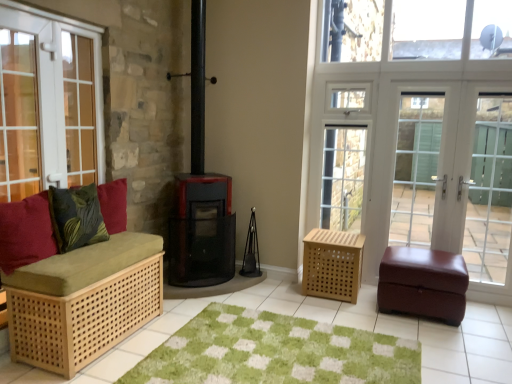
The image size is (512, 384). What do you see at coordinates (275, 352) in the screenshot?
I see `green textured mat at center` at bounding box center [275, 352].

The image size is (512, 384). I want to click on velvet red cushion at left, which ranks as the 1th pillow in front-to-back order, so click(26, 232).

This screenshot has height=384, width=512. What do you see at coordinates (26, 232) in the screenshot?
I see `velvet red cushion at left, which ranks as the 1th pillow in front-to-back order` at bounding box center [26, 232].

At what (x,y) coordinates should I click in order to perform the action: click on natural wood bench at left, which is the third furniture from right to left. Please return your answer as a coordinate pair (x, y). This screenshot has width=512, height=384. Looking at the image, I should click on 84,293.

Locate an element on the screen. This screenshot has height=384, width=512. white glass screen door at right, placed as the third screen door when sorted from right to left is located at coordinates (417, 168).

The height and width of the screenshot is (384, 512). What do you see at coordinates (76, 217) in the screenshot?
I see `velvety green pillow at left, the first pillow when ordered from back to front` at bounding box center [76, 217].

The width and height of the screenshot is (512, 384). I want to click on green textured mat at center, so click(x=275, y=352).

Does transparent glass window at upper center turn towards matte white screen door at right, the second screen door in the left-to-right sequence?

No, transparent glass window at upper center is not oriented towards matte white screen door at right, the second screen door in the left-to-right sequence.

Which object is positioned more to the right, transparent glass window at upper center or matte white screen door at right, the 2th screen door in the right-to-left sequence?

Positioned to the right is matte white screen door at right, the 2th screen door in the right-to-left sequence.

Does point (40, 130) come closer to viewer compared to point (90, 221)?

Yes, it is.

From the image's perspective, is white glass door at left positioned above or below velvety green pillow at left, the 2th pillow viewed from the front?

white glass door at left is situated higher than velvety green pillow at left, the 2th pillow viewed from the front, in the image.

Is white glass door at left oriented away from velvety green pillow at left, the 2th pillow viewed from the front?

No.

Locate an element on the screen. Image resolution: width=512 pixels, height=384 pixels. window located above the velvety green pillow at left, the first pillow when ordered from back to front (from the image's perspective) is located at coordinates (48, 104).

From the image's perspective, between white glass screen door at right, placed as the first screen door when sorted from left to right, and velvety green pillow at left, the first pillow when ordered from back to front, which one is located above?

white glass screen door at right, placed as the first screen door when sorted from left to right.

Is point (408, 146) closer or farther from the camera than point (64, 205)?

Point (408, 146).

Is white glass screen door at right, placed as the first screen door when sorted from left to right, thinner than velvety green pillow at left, the first pillow when ordered from back to front?

Indeed, white glass screen door at right, placed as the first screen door when sorted from left to right, has a lesser width compared to velvety green pillow at left, the first pillow when ordered from back to front.

Is white glass screen door at right, which ranks as the 1th screen door in right-to-left order, shorter than matte white screen door at right, the second screen door in the left-to-right sequence?

Correct, white glass screen door at right, which ranks as the 1th screen door in right-to-left order, is not as tall as matte white screen door at right, the second screen door in the left-to-right sequence.

Is white glass screen door at right, which ranks as the 1th screen door in right-to-left order, facing towards matte white screen door at right, the 2th screen door in the right-to-left sequence?

Yes, white glass screen door at right, which ranks as the 1th screen door in right-to-left order, faces towards matte white screen door at right, the 2th screen door in the right-to-left sequence.

Image resolution: width=512 pixels, height=384 pixels. What are the coordinates of `screen door that is the 2nd one above the white glass screen door at right, the 3th screen door viewed from the left (from a real-world perspective)` in the screenshot? It's located at (456, 177).

Who is taller, velvety green pillow at left, the first pillow when ordered from back to front, or black mesh wood burning stove at center?

With more height is black mesh wood burning stove at center.

Does point (78, 234) come closer to viewer compared to point (176, 215)?

Yes, point (78, 234) is in front of point (176, 215).

Which object is closer to the camera taking this photo, velvety green pillow at left, the first pillow when ordered from back to front, or black mesh wood burning stove at center?

velvety green pillow at left, the first pillow when ordered from back to front.

Is white glass screen door at right, which ranks as the 1th screen door in right-to-left order, taller or shorter than green textured mat at center?

Considering their sizes, white glass screen door at right, which ranks as the 1th screen door in right-to-left order, has more height than green textured mat at center.

From the green textured mat at center, count 3rd screen door to the right and point to it. Please provide its 2D coordinates.

[(490, 190)]

From the image's perspective, is white glass screen door at right, the 3th screen door viewed from the left, located above or below green textured mat at center?

Clearly, from the image's perspective, white glass screen door at right, the 3th screen door viewed from the left, is above green textured mat at center.

Consider the image. Who is bigger, white glass screen door at right, which ranks as the 1th screen door in right-to-left order, or green textured mat at center?

With larger size is white glass screen door at right, which ranks as the 1th screen door in right-to-left order.

Is green textured mat at center closer to the viewer compared to black mesh wood burning stove at center?

That is True.

From a real-world perspective, relative to black mesh wood burning stove at center, is green textured mat at center vertically above or below?

In terms of real-world spatial position, green textured mat at center is below black mesh wood burning stove at center.

Between green textured mat at center and black mesh wood burning stove at center, which one has more height?

With more height is black mesh wood burning stove at center.

Does green textured mat at center have a greater width compared to black mesh wood burning stove at center?

Correct, the width of green textured mat at center exceeds that of black mesh wood burning stove at center.

The width and height of the screenshot is (512, 384). I want to click on window screen lying above the matte white screen door at right, the 2th screen door in the right-to-left sequence (from the image's perspective), so click(x=426, y=29).

From the image's perspective, which pillow is the 1st one below the white glass door at left? Please provide its 2D coordinates.

[(76, 217)]

Looking at the image, which one is located closer to black mesh wood burning stove at center, white glass screen door at right, the 3th screen door viewed from the left, or velvet red cushion at left, which ranks as the 1th pillow in front-to-back order?

Among the two, velvet red cushion at left, which ranks as the 1th pillow in front-to-back order, is located nearer to black mesh wood burning stove at center.

Based on their spatial positions, is transparent glass window at upper center or velvet red cushion at left, the second pillow in the back-to-front sequence, closer to black mesh wood burning stove at center?

Based on the image, velvet red cushion at left, the second pillow in the back-to-front sequence, appears to be nearer to black mesh wood burning stove at center.

When comparing their distances from natural wood bench at left, which is the third furniture from right to left, does light brown woven basket at center-right, the second furniture when ordered from right to left, or burgundy leather ottoman at right, arranged as the 1th furniture when viewed from the right, seem further?

burgundy leather ottoman at right, arranged as the 1th furniture when viewed from the right, is further to natural wood bench at left, which is the third furniture from right to left.

Looking at the image, which one is located further to velvet red cushion at left, which ranks as the 1th pillow in front-to-back order, light brown woven basket at center-right, which ranks as the 2th furniture in left-to-right order, or white glass screen door at right, the 3th screen door viewed from the left?

white glass screen door at right, the 3th screen door viewed from the left.

From the picture: Estimate the real-world distances between objects in this image. Which object is further from black mesh wood burning stove at center, velvet red cushion at left, the second pillow in the back-to-front sequence, or light brown woven basket at center-right, the second furniture when ordered from right to left?

Based on the image, velvet red cushion at left, the second pillow in the back-to-front sequence, appears to be further to black mesh wood burning stove at center.

When comparing their distances from velvety green pillow at left, the 2th pillow viewed from the front, does white glass door at left or velvet red cushion at left, the second pillow in the back-to-front sequence, seem closer?

Among the two, velvet red cushion at left, the second pillow in the back-to-front sequence, is located nearer to velvety green pillow at left, the 2th pillow viewed from the front.

From the image, which object appears to be farther from velvet red cushion at left, which ranks as the 1th pillow in front-to-back order, velvety green pillow at left, the first pillow when ordered from back to front, or transparent glass window at upper center?

transparent glass window at upper center lies further to velvet red cushion at left, which ranks as the 1th pillow in front-to-back order, than the other object.

Considering their positions, is natural wood bench at left, the first furniture viewed from the left, positioned closer to white glass screen door at right, which ranks as the 1th screen door in right-to-left order, than light brown woven basket at center-right, which ranks as the 2th furniture in left-to-right order?

light brown woven basket at center-right, which ranks as the 2th furniture in left-to-right order, lies closer to white glass screen door at right, which ranks as the 1th screen door in right-to-left order, than the other object.

Image resolution: width=512 pixels, height=384 pixels. In order to click on wood burning stove located between white glass door at left and white glass screen door at right, the 3th screen door viewed from the left, in the left-right direction in this screenshot , I will do `click(202, 231)`.

The height and width of the screenshot is (384, 512). In order to click on screen door between white glass door at left and matte white screen door at right, the second screen door in the left-to-right sequence in this screenshot , I will do `click(417, 168)`.

Image resolution: width=512 pixels, height=384 pixels. I want to click on wood burning stove between natural wood bench at left, which is the third furniture from right to left, and white glass screen door at right, placed as the first screen door when sorted from left to right, so click(202, 231).

The height and width of the screenshot is (384, 512). What are the coordinates of `wood burning stove between velvet red cushion at left, the second pillow in the back-to-front sequence, and white glass screen door at right, placed as the first screen door when sorted from left to right, in the horizontal direction` in the screenshot? It's located at (202, 231).